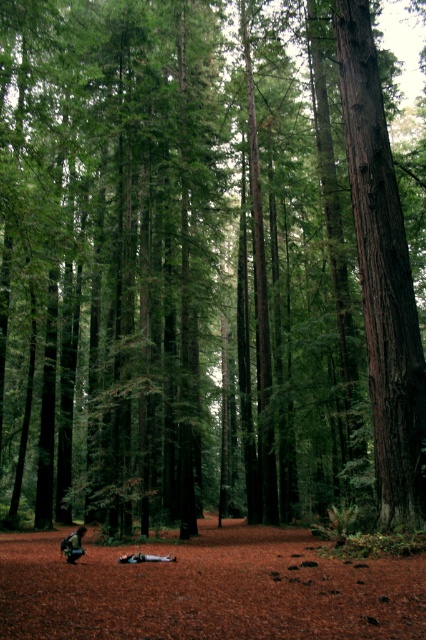
Who is lower down, dark green fabric backpack at lower left or light blue fabric at lower center?

dark green fabric backpack at lower left is lower down.

Does dark green fabric backpack at lower left appear under light blue fabric at lower center?

Correct, dark green fabric backpack at lower left is located below light blue fabric at lower center.

What are the coordinates of `dark green fabric backpack at lower left` in the screenshot? It's located at (72, 545).